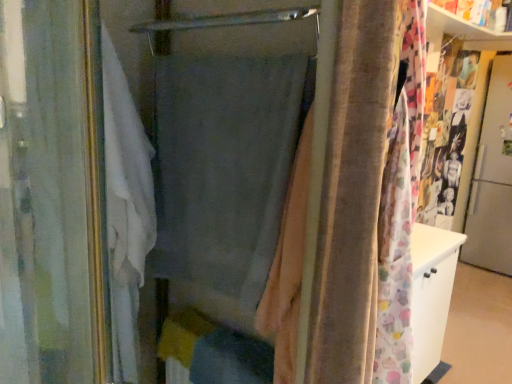
Question: From the image's perspective, is beige velvety fabric at center located above or below metallic silver screen door at right?

Choices:
 (A) below
 (B) above

Answer: (A)

Question: Considering the positions of beige velvety fabric at center and metallic silver screen door at right in the image, is beige velvety fabric at center taller or shorter than metallic silver screen door at right?

Choices:
 (A) short
 (B) tall

Answer: (A)

Question: Which object is the farthest from the metallic silver screen door at right?

Choices:
 (A) beige velvety fabric at center
 (B) gray fabric curtain at center, which appears as the 2th curtain when viewed from the left
 (C) white fabric curtain at left, the 1th curtain from the left

Answer: (C)

Question: Which of these objects is positioned closest to the beige velvety fabric at center?

Choices:
 (A) white fabric curtain at left, which appears as the 2th curtain when viewed from the right
 (B) gray fabric curtain at center, which appears as the 2th curtain when viewed from the left
 (C) metallic silver screen door at right

Answer: (B)